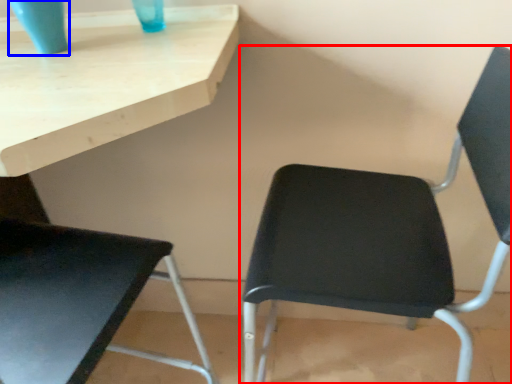
Question: Which object is closer to the camera taking this photo, chair (highlighted by a red box) or glass vase (highlighted by a blue box)?

Choices:
 (A) chair
 (B) glass vase

Answer: (A)